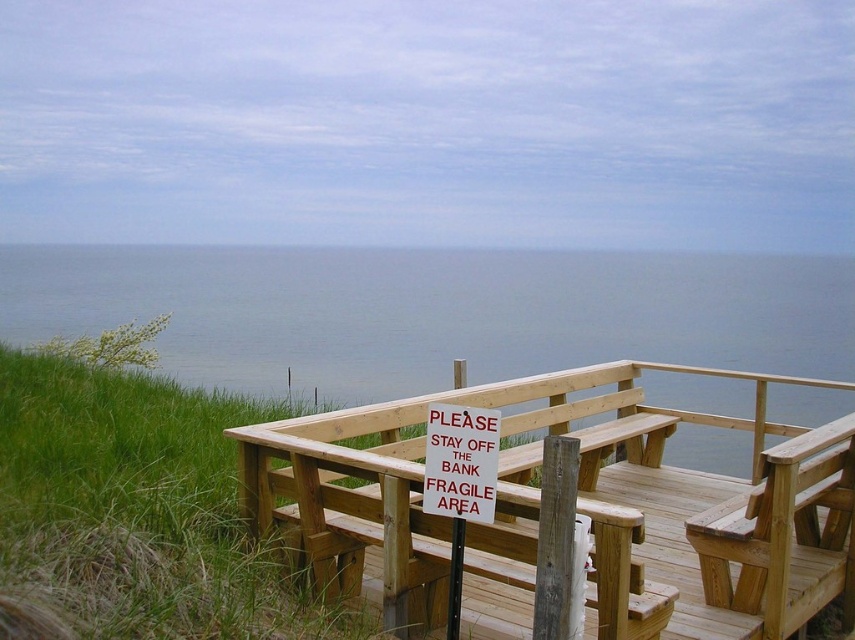
Based on the photo, can you confirm if wooden bench at center is positioned below white paper sign at center?

Yes.

Is wooden bench at center thinner than white paper sign at center?

In fact, wooden bench at center might be wider than white paper sign at center.

Who is more forward, [429,625] or [423,460]?

Point [423,460]

This screenshot has height=640, width=855. Find the location of `wooden bench at center`. wooden bench at center is located at coordinates (575, 506).

Is blue water at upper center closer to camera compared to white paper sign at center?

No, blue water at upper center is further to the viewer.

Is blue water at upper center taller than white paper sign at center?

Indeed, blue water at upper center has a greater height compared to white paper sign at center.

Describe the element at coordinates (432, 312) in the screenshot. I see `blue water at upper center` at that location.

Image resolution: width=855 pixels, height=640 pixels. Find the location of `blue water at upper center`. blue water at upper center is located at coordinates (432, 312).

Is blue water at upper center taller than wooden bench at center?

Indeed, blue water at upper center has a greater height compared to wooden bench at center.

Can you confirm if blue water at upper center is bigger than wooden bench at center?

Yes.

Is point (195, 257) farther from camera compared to point (276, 477)?

Yes, point (195, 257) is farther from viewer.

Find the location of `blue water at upper center`. blue water at upper center is located at coordinates (432, 312).